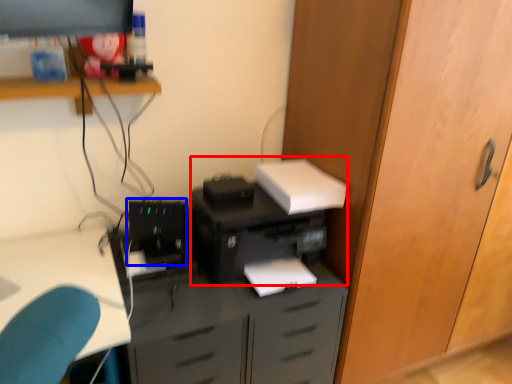
Question: Which point is further to the camera, printer (highlighted by a red box) or computer tower (highlighted by a blue box)?

Choices:
 (A) printer
 (B) computer tower

Answer: (B)